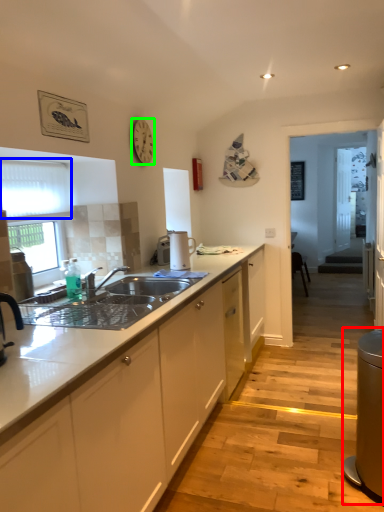
Question: Which object is positioned farthest from appliance (highlighted by a red box)? Select from window screen (highlighted by a blue box) and clock (highlighted by a green box).

Choices:
 (A) window screen
 (B) clock

Answer: (B)